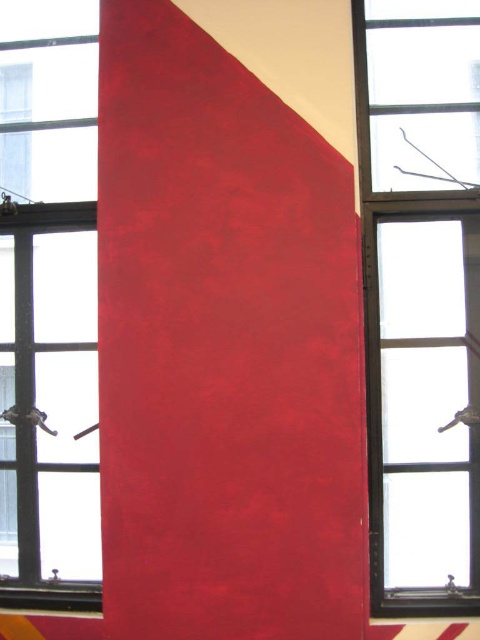
Which of these two, clear glass window at center or transparent glass window at center, stands shorter?

clear glass window at center is shorter.

Can you confirm if clear glass window at center is taller than transparent glass window at center?

In fact, clear glass window at center may be shorter than transparent glass window at center.

Does point (416, 516) come closer to viewer compared to point (19, 515)?

Yes.

Find the location of `clear glass window at center`. clear glass window at center is located at coordinates (420, 298).